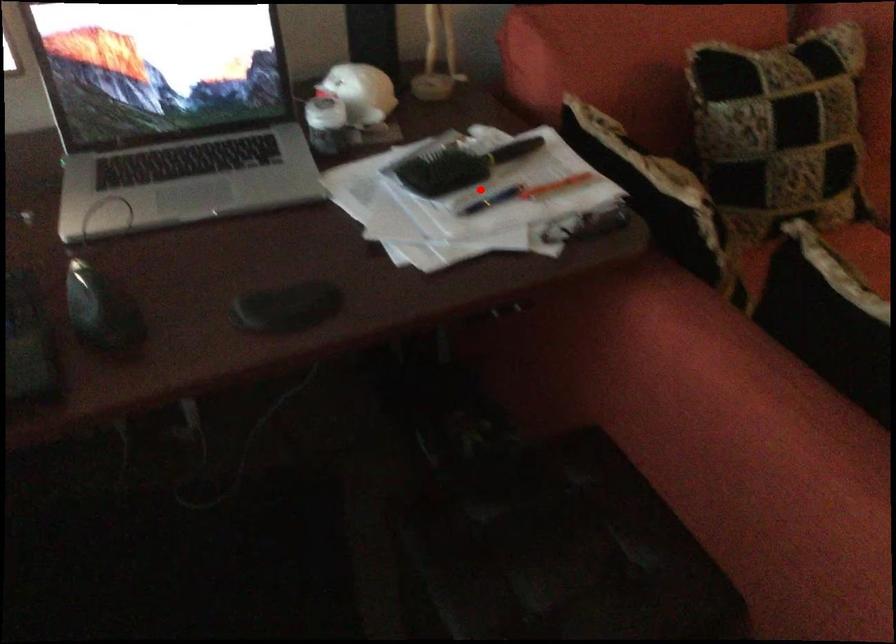
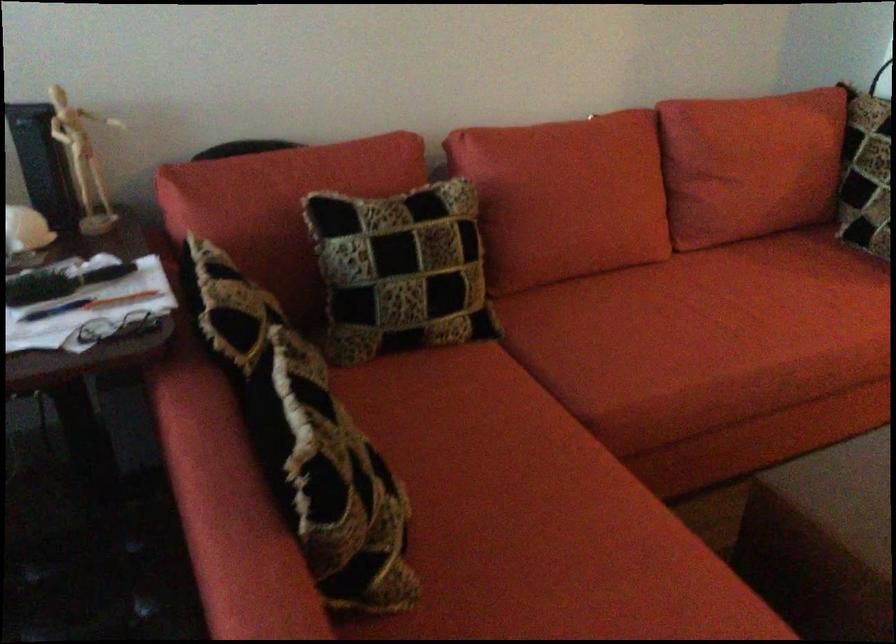
Find the pixel in the second image that matches the highlighted location in the first image.

(55, 310)